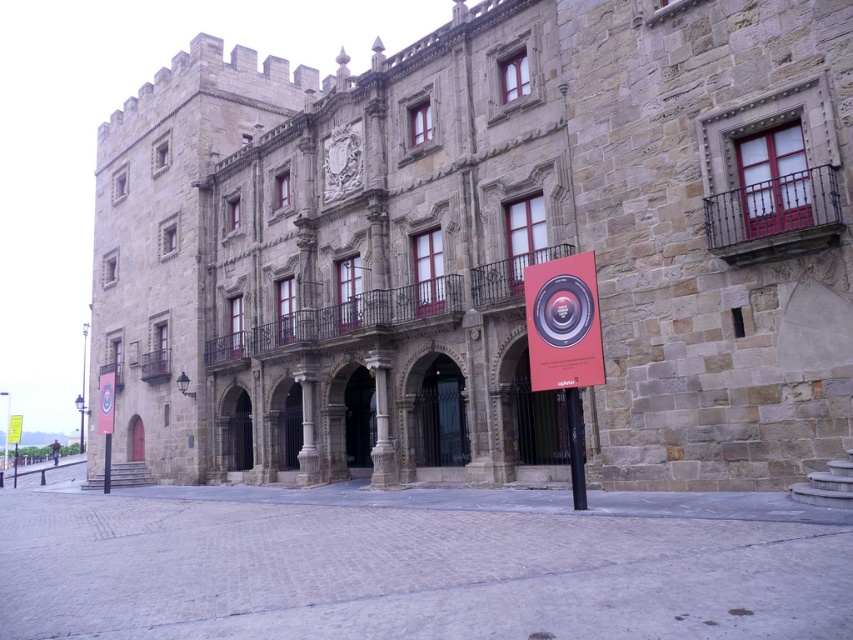
Question: Considering the real-world distances, which object is closest to the yellow paper sign at center?

Choices:
 (A) matte red poster at center
 (B) black metal pole at center

Answer: (A)

Question: Can you confirm if matte red poster at center is bigger than yellow paper sign at center?

Choices:
 (A) no
 (B) yes

Answer: (A)

Question: Estimate the real-world distances between objects in this image. Which object is farther from the black metal pole at center?

Choices:
 (A) matte red poster at center
 (B) yellow paper sign at center

Answer: (B)

Question: Does matte red poster at center come in front of yellow paper sign at center?

Choices:
 (A) yes
 (B) no

Answer: (A)

Question: Among these objects, which one is nearest to the camera?

Choices:
 (A) black metal pole at center
 (B) yellow paper sign at center
 (C) matte red poster at center

Answer: (C)

Question: Considering the relative positions of black metal pole at center and yellow paper sign at center in the image provided, where is black metal pole at center located with respect to yellow paper sign at center?

Choices:
 (A) above
 (B) below

Answer: (A)